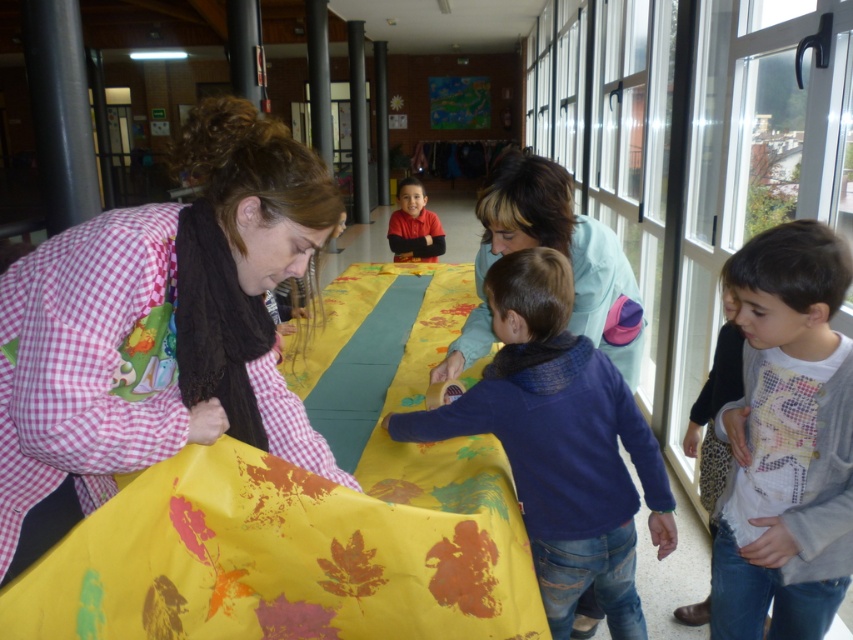
Question: Is pink checkered shirt at lower left wider than blue fleece sweater at center?

Choices:
 (A) yes
 (B) no

Answer: (B)

Question: Which object is the closest to the light blue fabric at center?

Choices:
 (A) blue fleece sweater at center
 (B) pink checkered shirt at lower left
 (C) matte red shirt at center

Answer: (A)

Question: Which point is farther to the camera?

Choices:
 (A) white printed sweater at lower right
 (B) blue fleece sweater at center

Answer: (B)

Question: Which of the following is the farthest from the observer?

Choices:
 (A) (515, 292)
 (B) (827, 285)

Answer: (A)

Question: Considering the relative positions of pink checkered shirt at lower left and matte red shirt at center in the image provided, where is pink checkered shirt at lower left located with respect to matte red shirt at center?

Choices:
 (A) right
 (B) left

Answer: (B)

Question: Can you confirm if blue fleece sweater at center is positioned to the left of matte red shirt at center?

Choices:
 (A) yes
 (B) no

Answer: (B)